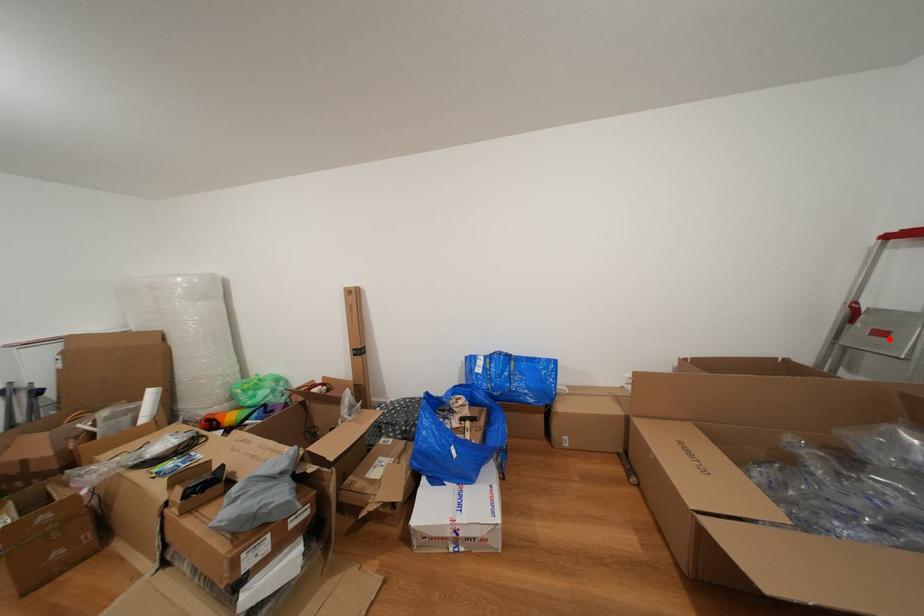
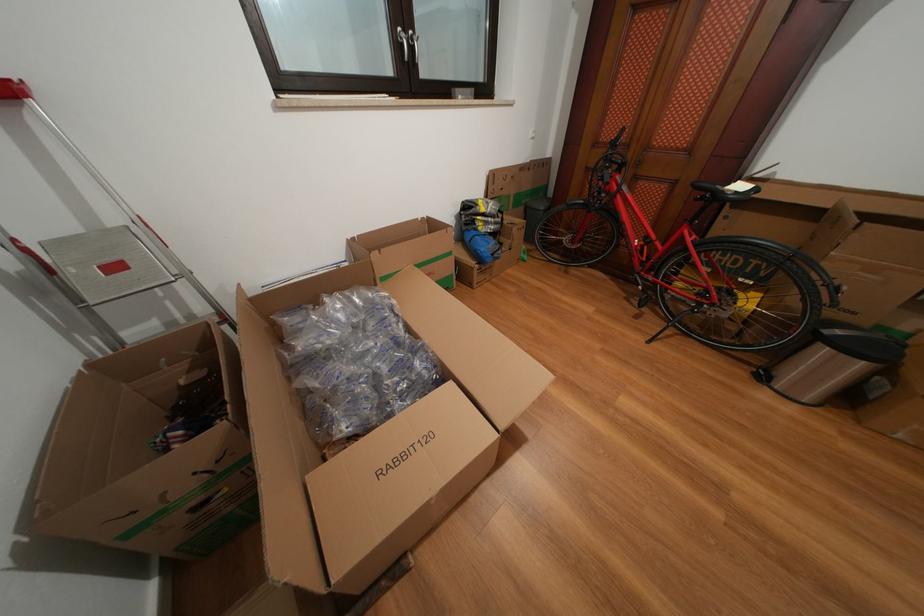
Locate, in the second image, the point that corresponds to the highlighted location in the first image.

(124, 273)